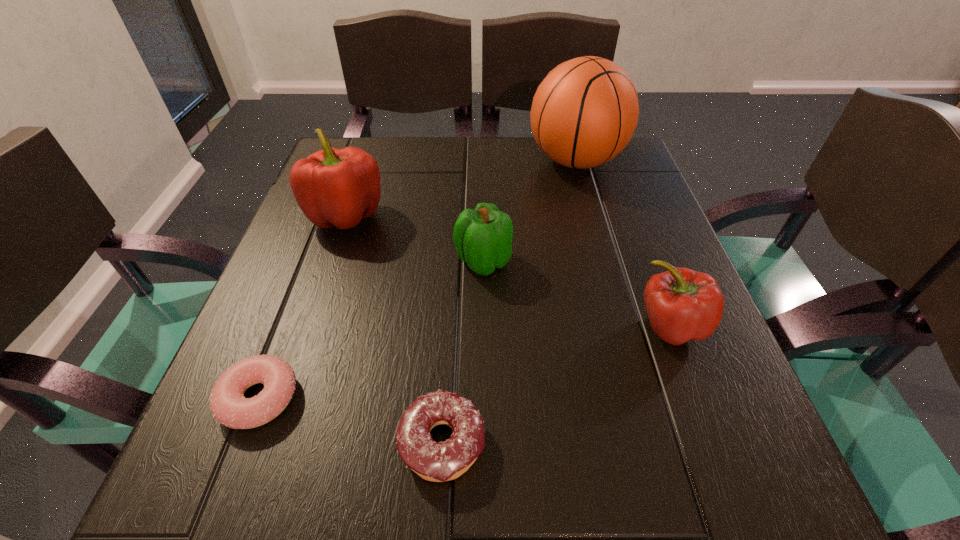
Locate an element on the screen. This screenshot has height=540, width=960. free space at the near right corner is located at coordinates (709, 495).

What are the coordinates of `free spot between the right doughnut and the farthest object` in the screenshot? It's located at (509, 301).

Where is `vacant area that lies between the shortest object and the nearest bell pepper`? vacant area that lies between the shortest object and the nearest bell pepper is located at coordinates (465, 362).

The height and width of the screenshot is (540, 960). What are the coordinates of `free space between the second tallest object and the shortest object` in the screenshot? It's located at (302, 307).

Identify the location of unoccupied area between the fifth nearest object and the right doughnut. (394, 328).

Locate an element on the screen. The image size is (960, 540). free space between the taller doughnut and the second tallest object is located at coordinates (394, 328).

You are a GUI agent. You are given a task and a screenshot of the screen. Output one action in this format:
    pyautogui.click(x=<x>, y=<y>)
    Task: Click on the free space that is in between the second nearest bell pepper and the rightmost bell pepper
    Image resolution: width=960 pixels, height=540 pixels.
    Given the screenshot: What is the action you would take?
    pyautogui.click(x=577, y=293)

Locate an element on the screen. This screenshot has height=540, width=960. vacant area that lies between the right doughnut and the fifth nearest object is located at coordinates (394, 328).

Where is `free point between the second bell pepper from right to left and the second farthest object`? free point between the second bell pepper from right to left and the second farthest object is located at coordinates (415, 238).

The height and width of the screenshot is (540, 960). Identify the location of empty location between the fourth nearest object and the second tallest object. (415, 238).